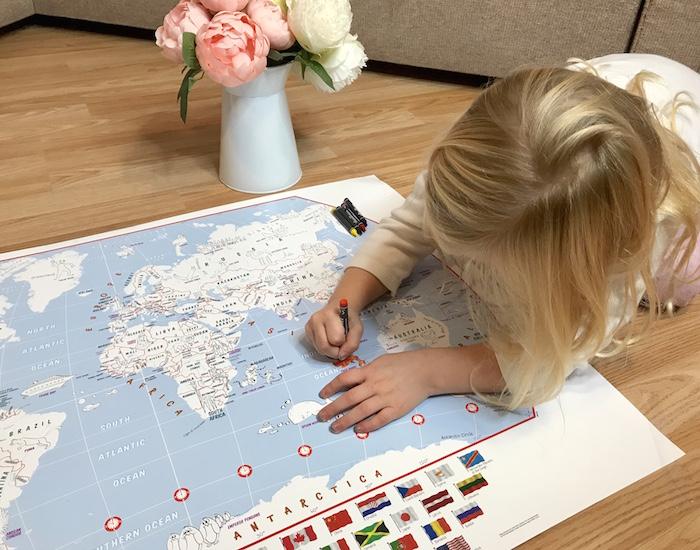
Locate an element on the screen. This screenshot has height=550, width=700. vase is located at coordinates (252, 140).